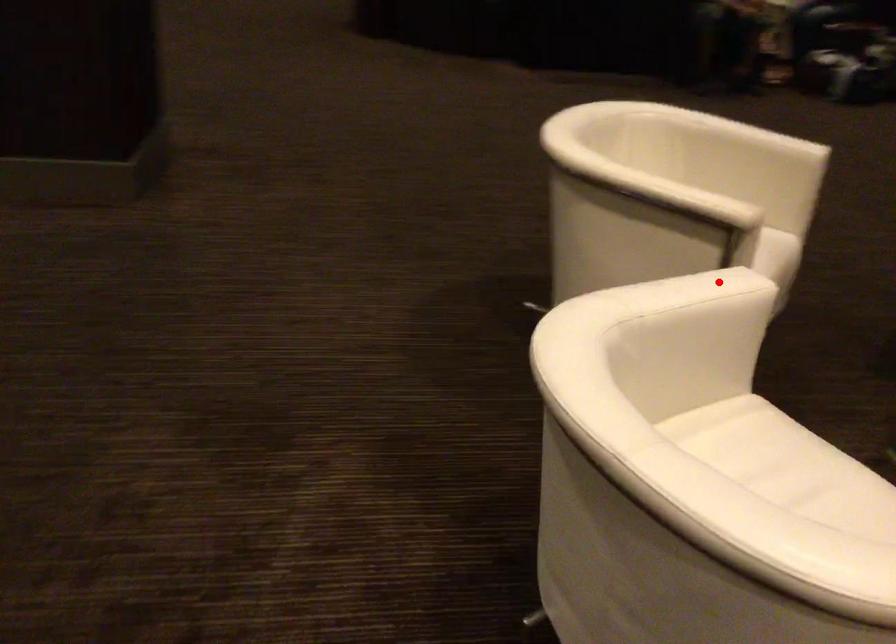
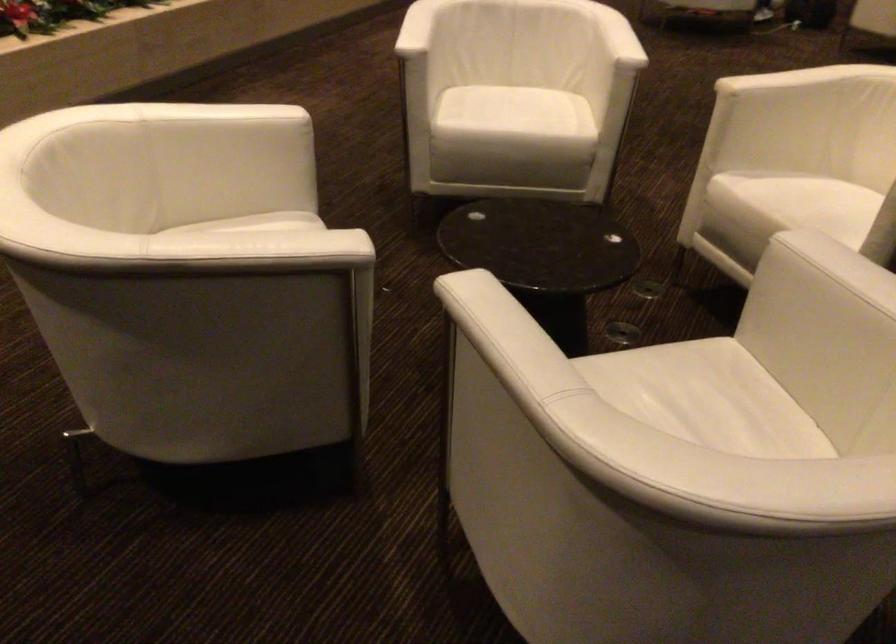
Locate, in the second image, the point that corresponds to the highlighted location in the first image.

(617, 37)